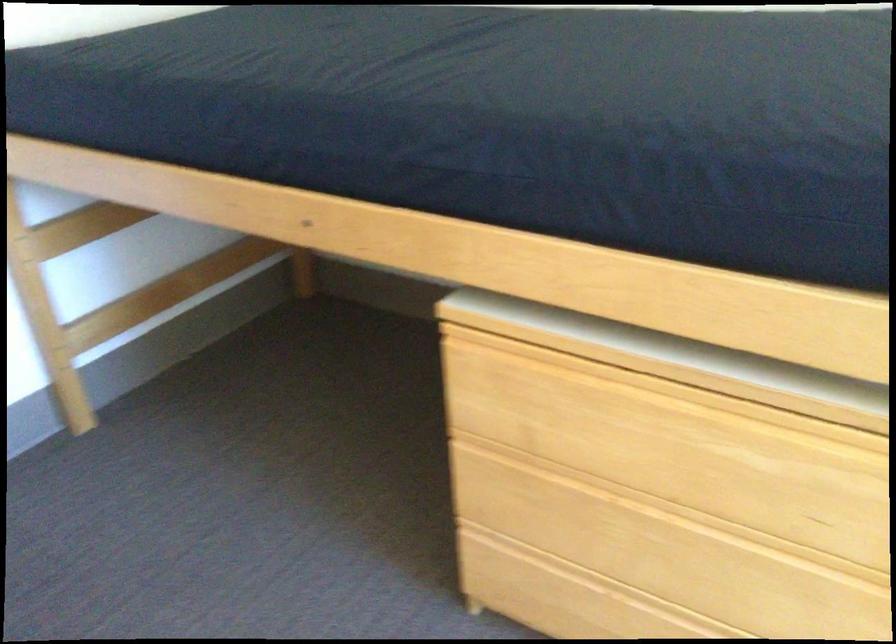
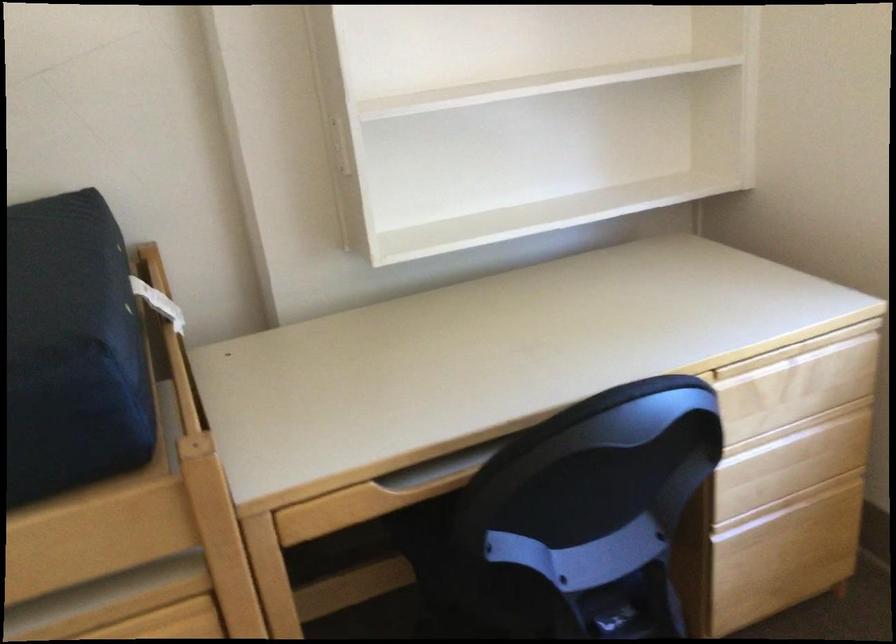
Question: The camera is either moving clockwise (left) or counter-clockwise (right) around the object. The first image is from the beginning of the video and the second image is from the end. Is the camera moving left or right when shooting the video?

Choices:
 (A) Left
 (B) Right

Answer: (A)